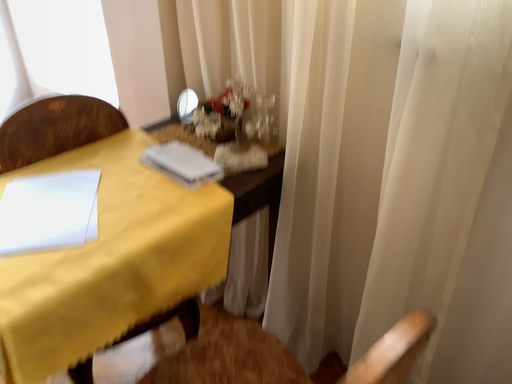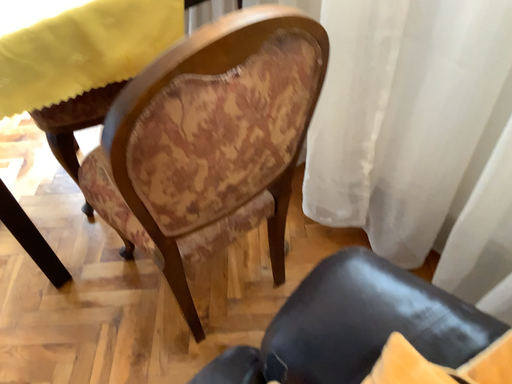
Question: How did the camera likely rotate when shooting the video?

Choices:
 (A) rotated upward
 (B) rotated downward

Answer: (B)